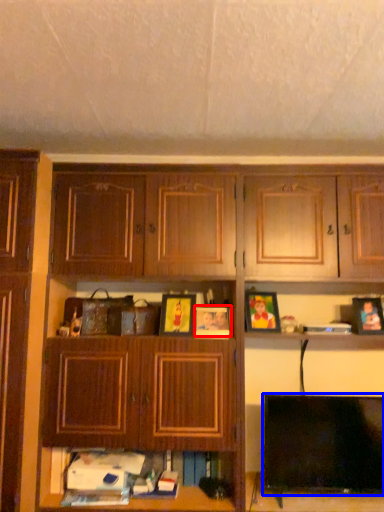
Question: Which point is closer to the camera, picture frame (highlighted by a red box) or television (highlighted by a blue box)?

Choices:
 (A) picture frame
 (B) television

Answer: (B)